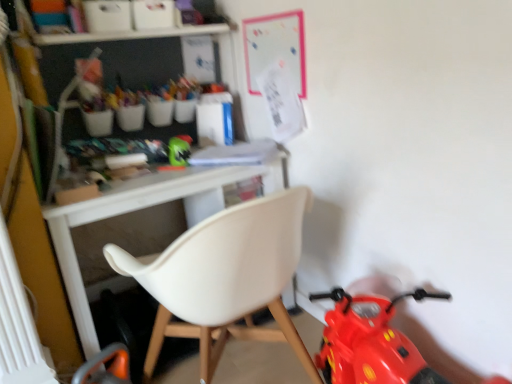
Question: From the image's perspective, does white plastic radiator at lower left appear lower than white plastic chair at center?

Choices:
 (A) no
 (B) yes

Answer: (A)

Question: Considering the relative sizes of white plastic radiator at lower left and white plastic chair at center in the image provided, is white plastic radiator at lower left bigger than white plastic chair at center?

Choices:
 (A) no
 (B) yes

Answer: (A)

Question: Is white plastic radiator at lower left turned away from white plastic chair at center?

Choices:
 (A) no
 (B) yes

Answer: (A)

Question: From the image's perspective, is white plastic radiator at lower left on top of white plastic chair at center?

Choices:
 (A) yes
 (B) no

Answer: (A)

Question: Does white plastic radiator at lower left lie behind white plastic chair at center?

Choices:
 (A) yes
 (B) no

Answer: (A)

Question: From the image's perspective, relative to green matte helmet at center, is white plastic radiator at lower left above or below?

Choices:
 (A) below
 (B) above

Answer: (A)

Question: From a real-world perspective, is white plastic radiator at lower left above or below green matte helmet at center?

Choices:
 (A) above
 (B) below

Answer: (B)

Question: Considering the positions of white plastic radiator at lower left and green matte helmet at center in the image, is white plastic radiator at lower left bigger or smaller than green matte helmet at center?

Choices:
 (A) big
 (B) small

Answer: (A)

Question: In the image, is white plastic radiator at lower left positioned in front of or behind green matte helmet at center?

Choices:
 (A) front
 (B) behind

Answer: (A)

Question: Considering their positions, is green matte helmet at center located in front of or behind white plastic radiator at lower left?

Choices:
 (A) front
 (B) behind

Answer: (B)

Question: Is green matte helmet at center inside or outside of white plastic radiator at lower left?

Choices:
 (A) inside
 (B) outside

Answer: (B)

Question: Considering the positions of point tap(190, 137) and point tap(19, 322), is point tap(190, 137) closer or farther from the camera than point tap(19, 322)?

Choices:
 (A) farther
 (B) closer

Answer: (A)

Question: From their relative heights in the image, would you say green matte helmet at center is taller or shorter than white plastic radiator at lower left?

Choices:
 (A) tall
 (B) short

Answer: (B)

Question: From their relative heights in the image, would you say green matte helmet at center is taller or shorter than white plastic chair at center?

Choices:
 (A) short
 (B) tall

Answer: (A)

Question: Based on their sizes in the image, would you say green matte helmet at center is bigger or smaller than white plastic chair at center?

Choices:
 (A) big
 (B) small

Answer: (B)